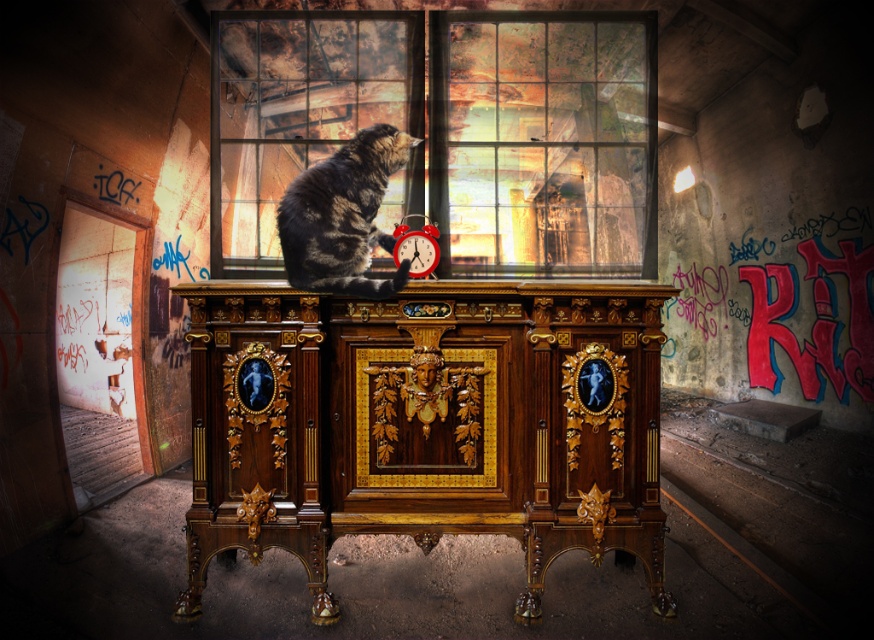
Question: Does polished wood dresser at center appear on the left side of clear glass window at center?

Choices:
 (A) yes
 (B) no

Answer: (A)

Question: Which object is positioned farthest from the glass pane at center?

Choices:
 (A) polished wood dresser at center
 (B) clear glass window at center
 (C) tabby fur cat at center
 (D) red alarm clock at center

Answer: (A)

Question: Is polished wood dresser at center wider than red alarm clock at center?

Choices:
 (A) yes
 (B) no

Answer: (A)

Question: Which of these objects is positioned closest to the clear glass window at center?

Choices:
 (A) polished wood dresser at center
 (B) glass pane at center
 (C) red alarm clock at center
 (D) tabby fur cat at center

Answer: (B)

Question: Which point is closer to the camera taking this photo?

Choices:
 (A) (411, 252)
 (B) (533, 77)

Answer: (A)

Question: In this image, where is glass pane at center located relative to red alarm clock at center?

Choices:
 (A) above
 (B) below

Answer: (A)